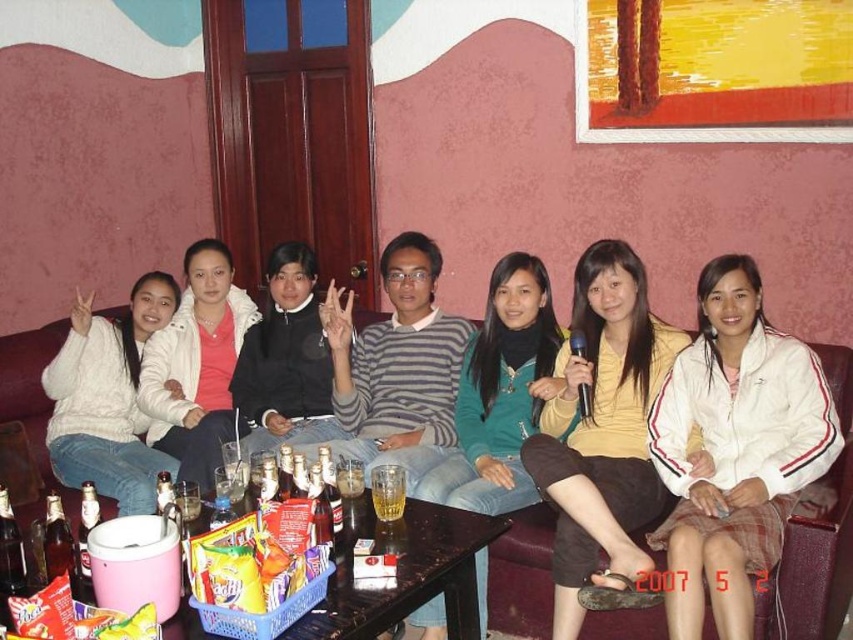
You are a photographer trying to capture a group photo of the seven people sitting on the brown leather couch at center. You notice the white fabric jacket at center is blocking part of the view. Can you adjust your position to avoid the jacket without moving the people?

The white fabric jacket at center is taller than the brown leather couch at center, so moving the camera slightly to the side or adjusting the angle could allow you to avoid the jacket while keeping the group in frame.

In the scene shown: You are standing in the lounge and need to find the white knit sweater at left. According to the coordinates provided, where exactly is it positioned?

The white knit sweater at left is located at point (107, 397), so it is positioned at that coordinate.

You are a photographer trying to capture a group photo of the seven people on the red sofa. The photographer wants to ensure that the white knit sweater at left and the black matte jacket at center are clearly visible in the photo. Given that the camera has a minimum focus distance of 18 inches, will the photographer need to adjust the camera settings to focus on both items simultaneously?

The white knit sweater at left is 19.63 inches from the black matte jacket at center. Since the distance between them is just over the camera minimum focus distance of 18 inches, the photographer will need to adjust the camera settings to focus on both items simultaneously.